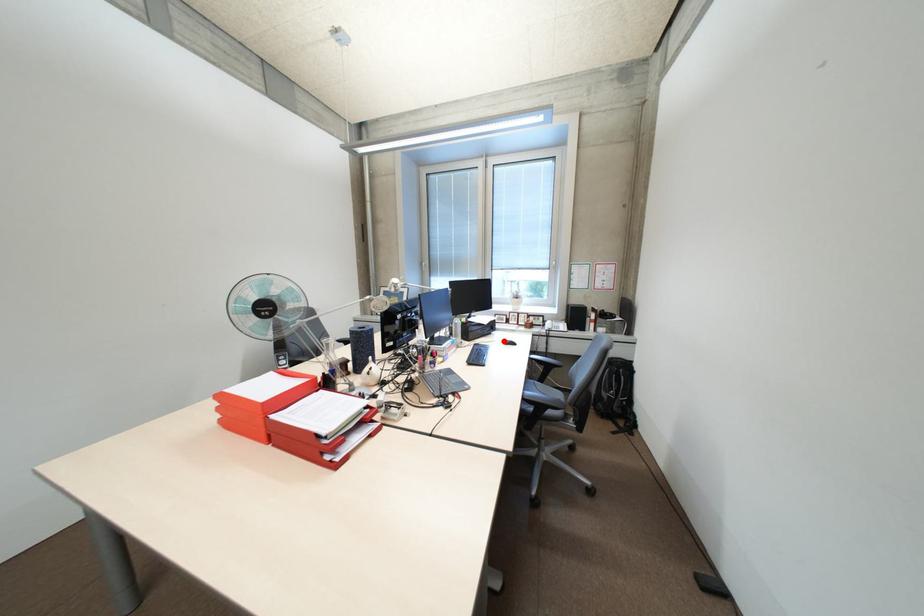
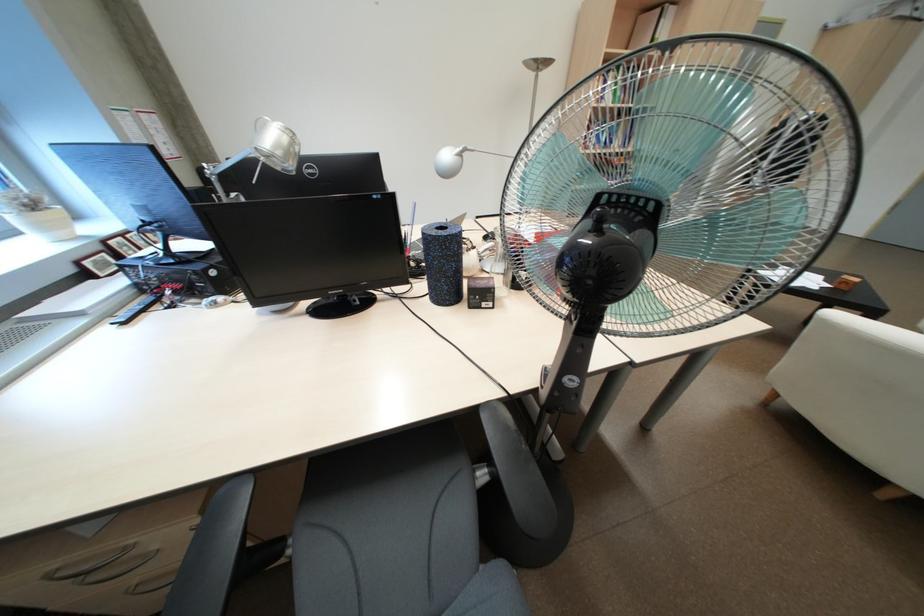
Question: I am providing you with two images of the same scene from different viewpoints. A red point is marked on the first image. Can you still see the location of the red point in image 2?

Choices:
 (A) Yes
 (B) No

Answer: (B)